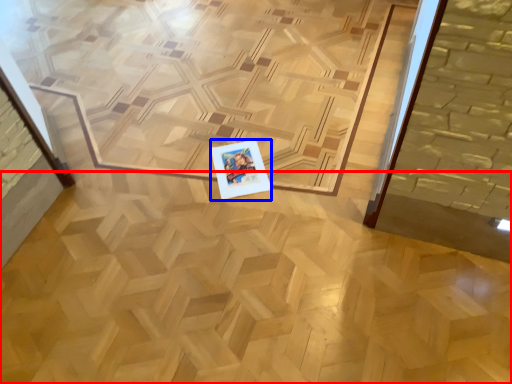
Question: Which of the following is the farthest to the observer, plywood (highlighted by a red box) or postcard (highlighted by a blue box)?

Choices:
 (A) plywood
 (B) postcard

Answer: (B)